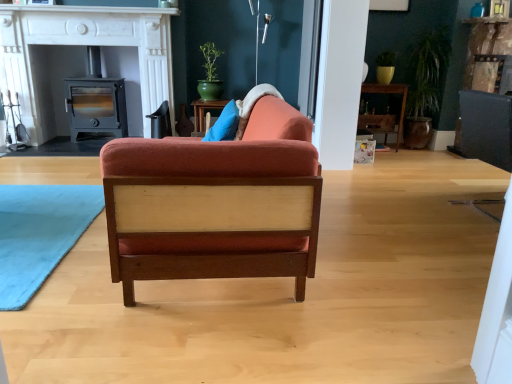
In order to face wooden shelf at center, should I rotate leftwards or rightwards?

A 15.603 degree turn to the right will do.

In order to click on green glazed pot at upper center in this screenshot , I will do [x=210, y=59].

Image resolution: width=512 pixels, height=384 pixels. What are the coordinates of `wooden shelf at center` in the screenshot? It's located at (390, 93).

Is matte black wood-burning stove at left positioned with its back to wooden shelf at center?

matte black wood-burning stove at left is not turned away from wooden shelf at center.

Identify the location of table below the matte black wood-burning stove at left (from the image's perspective). (390, 93).

From a real-world perspective, is matte black wood-burning stove at left below wooden shelf at center?

No, from a real-world perspective, matte black wood-burning stove at left is not below wooden shelf at center.

Between matte black wood-burning stove at left and wooden shelf at center, which one has more height?

With more height is matte black wood-burning stove at left.

Is velvet orange chair at center with wooden shelf at center?

No, velvet orange chair at center is not making contact with wooden shelf at center.

Looking at this image, in the image, is velvet orange chair at center positioned in front of or behind wooden shelf at center?

In the image, velvet orange chair at center appears in front of wooden shelf at center.

In terms of width, does velvet orange chair at center look wider or thinner when compared to wooden shelf at center?

Considering their sizes, velvet orange chair at center looks broader than wooden shelf at center.

Does point (215, 170) appear closer or farther from the camera than point (397, 141)?

Point (215, 170) appears to be closer to the viewer than point (397, 141).

From their relative heights in the image, would you say velvet orange chair at center is taller or shorter than green glazed pot at upper center?

velvet orange chair at center is taller than green glazed pot at upper center.

From the image's perspective, is velvet orange chair at center above or below green glazed pot at upper center?

velvet orange chair at center is situated lower than green glazed pot at upper center in the image.

Would you say velvet orange chair at center is a long distance from green glazed pot at upper center?

Yes.

Can you confirm if velvet orange chair at center is positioned to the left of green glazed pot at upper center?

Incorrect, velvet orange chair at center is not on the left side of green glazed pot at upper center.

The image size is (512, 384). Find the location of `fireplace that appears above the wooden shelf at center (from a real-world perspective)`. fireplace that appears above the wooden shelf at center (from a real-world perspective) is located at coordinates (x=84, y=45).

Based on the photo, in the image, is matte black wood stove at left positioned in front of or behind wooden shelf at center?

matte black wood stove at left is positioned closer to the viewer than wooden shelf at center.

Is matte black wood stove at left oriented towards wooden shelf at center?

No, matte black wood stove at left is not facing towards wooden shelf at center.

Considering the sizes of matte black wood stove at left and wooden shelf at center in the image, is matte black wood stove at left taller or shorter than wooden shelf at center?

Clearly, matte black wood stove at left is taller compared to wooden shelf at center.

Considering the relative sizes of matte black wood stove at left and matte black wood-burning stove at left in the image provided, is matte black wood stove at left taller than matte black wood-burning stove at left?

Yes, matte black wood stove at left is taller than matte black wood-burning stove at left.

From the image's perspective, does matte black wood stove at left appear higher than matte black wood-burning stove at left?

Yes, from the image's perspective, matte black wood stove at left is over matte black wood-burning stove at left.

Does point (18, 21) appear closer or farther from the camera than point (77, 108)?

Clearly, point (18, 21) is closer to the camera than point (77, 108).

Is matte black wood stove at left smaller than matte black wood-burning stove at left?

No, matte black wood stove at left is not smaller than matte black wood-burning stove at left.

Is wooden shelf at center not within matte black wood stove at left?

Absolutely, wooden shelf at center is external to matte black wood stove at left.

Between wooden shelf at center and matte black wood stove at left, which one appears on the right side from the viewer's perspective?

wooden shelf at center is more to the right.

From the image's perspective, relative to matte black wood stove at left, is wooden shelf at center above or below?

Clearly, from the image's perspective, wooden shelf at center is below matte black wood stove at left.

In the scene shown: Is wooden shelf at center turned away from matte black wood stove at left?

wooden shelf at center does not have its back to matte black wood stove at left.

Is matte black wood-burning stove at left thinner than velvet orange chair at center?

Correct, the width of matte black wood-burning stove at left is less than that of velvet orange chair at center.

From a real-world perspective, does matte black wood-burning stove at left stand above velvet orange chair at center?

Yes, from a real-world perspective, matte black wood-burning stove at left is above velvet orange chair at center.

Is matte black wood-burning stove at left inside the boundaries of velvet orange chair at center, or outside?

matte black wood-burning stove at left is spatially situated outside velvet orange chair at center.

What are the coordinates of `appliance that appears above the wooden shelf at center (from a real-world perspective)` in the screenshot? It's located at (96, 106).

Locate an element on the screen. Image resolution: width=512 pixels, height=384 pixels. table on the right side of velvet orange chair at center is located at coordinates (390, 93).

Based on the photo, estimate the real-world distances between objects in this image. Which object is further from matte black wood stove at left, wooden shelf at center or green glazed pot at upper center?

The object further to matte black wood stove at left is wooden shelf at center.

Looking at the image, which one is located further to green glazed pot at upper center, wooden shelf at center or velvet orange chair at center?

Based on the image, velvet orange chair at center appears to be further to green glazed pot at upper center.

Which object lies further to the anchor point wooden shelf at center, velvet orange chair at center or matte black wood-burning stove at left?

Based on the image, velvet orange chair at center appears to be further to wooden shelf at center.

Estimate the real-world distances between objects in this image. Which object is further from velvet orange chair at center, matte black wood-burning stove at left or matte black wood stove at left?

matte black wood-burning stove at left is positioned further to the anchor velvet orange chair at center.

Estimate the real-world distances between objects in this image. Which object is further from velvet orange chair at center, green glazed pot at upper center or wooden shelf at center?

wooden shelf at center lies further to velvet orange chair at center than the other object.

From the image, which object appears to be farther from velvet orange chair at center, matte black wood stove at left or wooden shelf at center?

wooden shelf at center is further to velvet orange chair at center.

When comparing their distances from matte black wood stove at left, does velvet orange chair at center or matte black wood-burning stove at left seem further?

velvet orange chair at center lies further to matte black wood stove at left than the other object.

From the picture: Estimate the real-world distances between objects in this image. Which object is further from matte black wood stove at left, green glazed pot at upper center or velvet orange chair at center?

velvet orange chair at center is positioned further to the anchor matte black wood stove at left.

This screenshot has width=512, height=384. What are the coordinates of `appliance positioned between velvet orange chair at center and wooden shelf at center from near to far` in the screenshot? It's located at (96, 106).

Locate an element on the screen. The width and height of the screenshot is (512, 384). plant between velvet orange chair at center and matte black wood-burning stove at left from front to back is located at coordinates (210, 59).

This screenshot has width=512, height=384. I want to click on fireplace located between velvet orange chair at center and matte black wood-burning stove at left in the depth direction, so click(84, 45).

You are a GUI agent. You are given a task and a screenshot of the screen. Output one action in this format:
    pyautogui.click(x=<x>, y=<y>)
    Task: Click on the fireplace positioned between velvet orange chair at center and green glazed pot at upper center from near to far
    The image size is (512, 384).
    Given the screenshot: What is the action you would take?
    pyautogui.click(x=84, y=45)